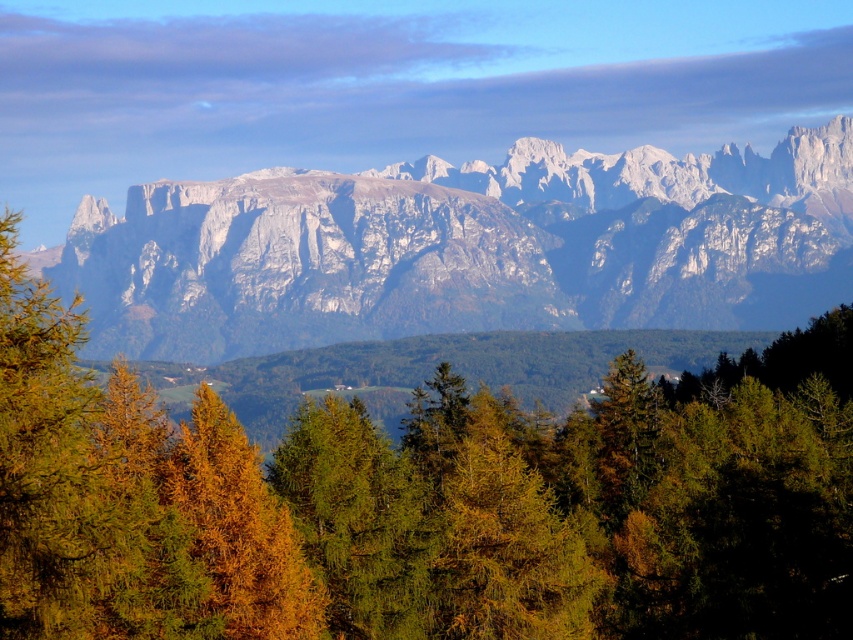
Question: Does green matte tree at center appear under white rocky mountain range at upper center?

Choices:
 (A) no
 (B) yes

Answer: (B)

Question: Which point is farther from the camera taking this photo?

Choices:
 (A) (807, 604)
 (B) (119, 337)

Answer: (B)

Question: Considering the relative positions of green matte tree at center and white rocky mountain range at upper center in the image provided, where is green matte tree at center located with respect to white rocky mountain range at upper center?

Choices:
 (A) left
 (B) right

Answer: (A)

Question: Can you confirm if green matte tree at center is positioned to the left of white rocky mountain range at upper center?

Choices:
 (A) yes
 (B) no

Answer: (A)